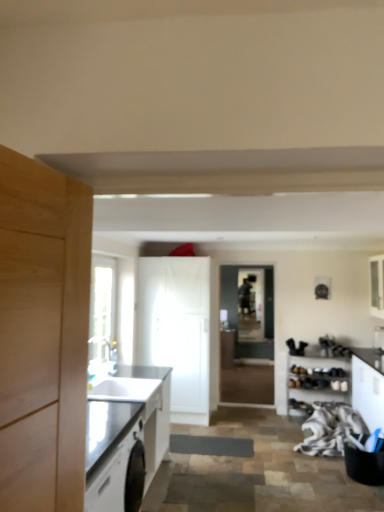
Question: Would you say transparent glass window screen at center is inside or outside white textured fabric at lower right?

Choices:
 (A) outside
 (B) inside

Answer: (A)

Question: Is transparent glass window screen at center in front of or behind white textured fabric at lower right in the image?

Choices:
 (A) front
 (B) behind

Answer: (B)

Question: Which object is the farthest from the transparent glass door at center?

Choices:
 (A) matte black countertop at left, positioned as the 1th cabinetry in left-to-right order
 (B) clear glass window at upper left
 (C) white glossy cabinet at right, placed as the fourth cabinetry when sorted from left to right
 (D) white glossy cabinet at center, the second cabinetry in the left-to-right sequence
 (E) transparent glass window screen at center

Answer: (A)

Question: Estimate the real-world distances between objects in this image. Which object is farther from the transparent glass window screen at center?

Choices:
 (A) white glossy cabinet at right, placed as the fourth cabinetry when sorted from left to right
 (B) transparent glass door at center
 (C) white textured fabric at lower right
 (D) white matte shoe rack at lower right, the 3th cabinetry in the right-to-left sequence
 (E) clear glass window at upper left

Answer: (E)